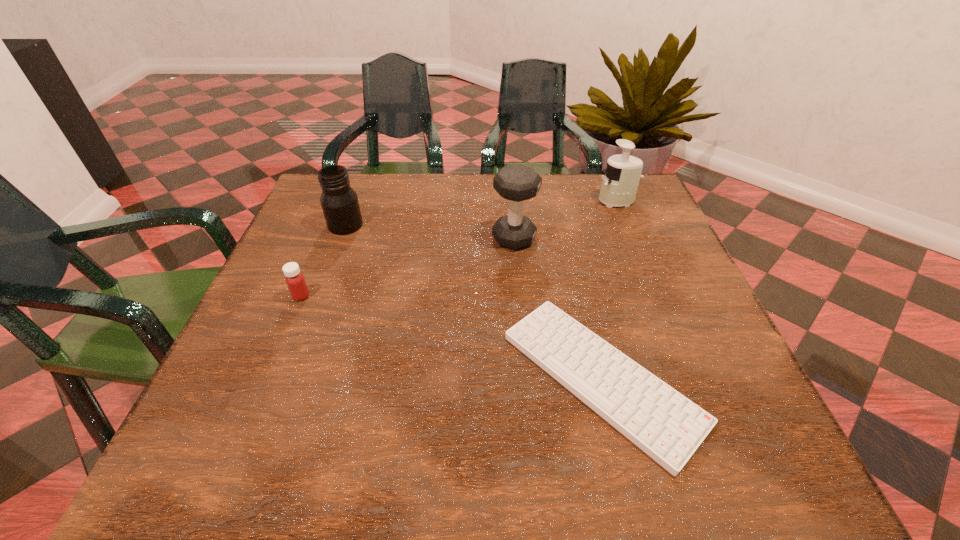
Image resolution: width=960 pixels, height=540 pixels. I want to click on free space located on the front of the fourth tallest object, so pos(252,415).

Locate an element on the screen. Image resolution: width=960 pixels, height=540 pixels. vacant space positioned 0.080m on the right of the nearest object is located at coordinates (739, 378).

You are a GUI agent. You are given a task and a screenshot of the screen. Output one action in this format:
    pyautogui.click(x=<x>, y=<y>)
    Task: Click on the juicer that is at the far edge
    This screenshot has width=960, height=540.
    Given the screenshot: What is the action you would take?
    pyautogui.click(x=621, y=177)

Locate an element on the screen. Image resolution: width=960 pixels, height=540 pixels. jar present at the far edge is located at coordinates (339, 202).

Find the location of `object located in the near edge section of the desktop`. object located in the near edge section of the desktop is located at coordinates (667, 426).

Identify the location of jar present at the left edge. (339, 202).

Where is `medicine at the left edge`? Image resolution: width=960 pixels, height=540 pixels. medicine at the left edge is located at coordinates (296, 283).

The width and height of the screenshot is (960, 540). What are the coordinates of `juicer that is positioned at the right edge` in the screenshot? It's located at (621, 177).

The image size is (960, 540). Identify the location of computer keyboard that is positioned at the right edge. (667, 426).

Locate an element on the screen. The image size is (960, 540). object situated at the far left corner is located at coordinates (339, 202).